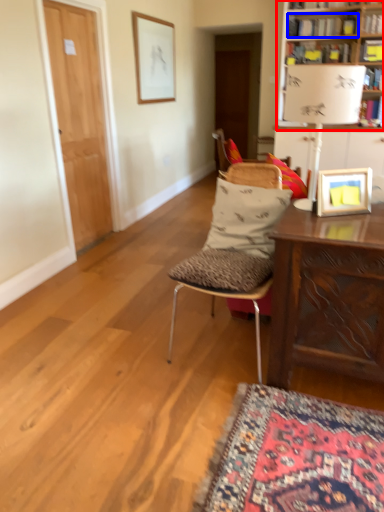
Question: Which point is further to the camera, bookcase (highlighted by a red box) or book (highlighted by a blue box)?

Choices:
 (A) bookcase
 (B) book

Answer: (B)